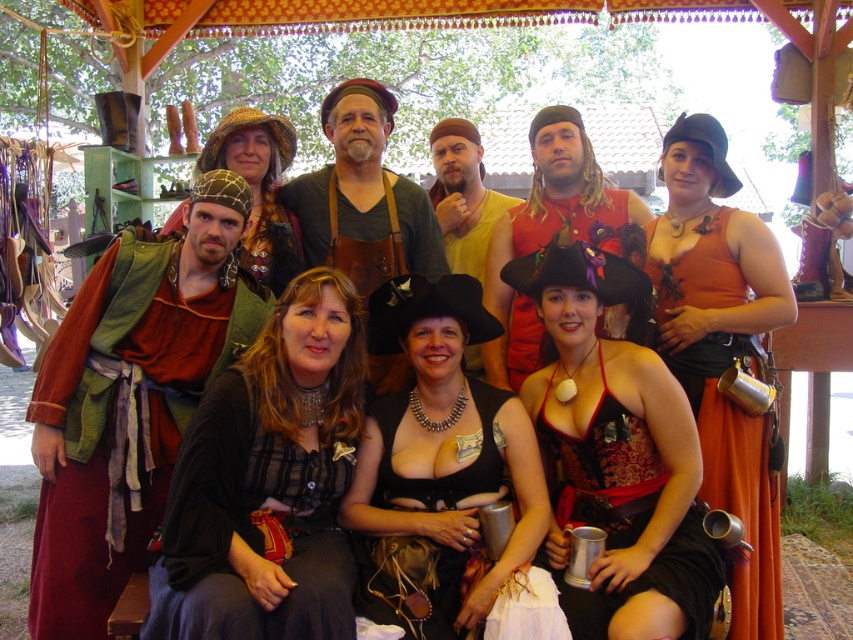
Which is below, black sheer blouse at center or black leather vest at center?

Positioned lower is black leather vest at center.

Is point (339, 296) positioned behind point (479, 289)?

No, (339, 296) is closer to viewer.

Is point (309, 580) closer to camera compared to point (375, 467)?

Yes, it is in front of point (375, 467).

In order to click on black sheer blouse at center in this screenshot , I will do `click(268, 481)`.

Does matte red tunic at left appear on the right side of matte brown hat at center?

Incorrect, matte red tunic at left is not on the right side of matte brown hat at center.

Does matte red tunic at left have a larger size compared to matte brown hat at center?

Yes.

Describe the element at coordinates (131, 400) in the screenshot. I see `matte red tunic at left` at that location.

Locate an element on the screen. matte red tunic at left is located at coordinates (131, 400).

Which is in front, point (351, 419) or point (259, 262)?

Point (351, 419) is more forward.

Is black sheer blouse at center to the left of matte brown hat at center from the viewer's perspective?

No, black sheer blouse at center is not to the left of matte brown hat at center.

Does point (316, 465) lie in front of point (234, 160)?

Yes, it is.

The image size is (853, 640). In order to click on black sheer blouse at center in this screenshot , I will do `click(268, 481)`.